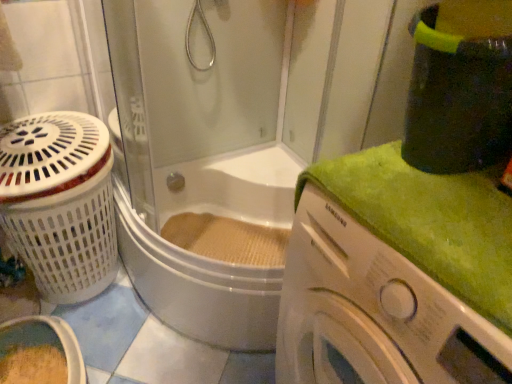
Question: Is white plastic laundry basket at left positioned behind transparent glass shower door at upper center?

Choices:
 (A) no
 (B) yes

Answer: (B)

Question: From the image's perspective, does white plastic laundry basket at left appear lower than transparent glass shower door at upper center?

Choices:
 (A) yes
 (B) no

Answer: (A)

Question: Is white plastic laundry basket at left smaller than transparent glass shower door at upper center?

Choices:
 (A) yes
 (B) no

Answer: (A)

Question: Is white plastic laundry basket at left at the right side of transparent glass shower door at upper center?

Choices:
 (A) no
 (B) yes

Answer: (A)

Question: From the image's perspective, is white plastic laundry basket at left on transparent glass shower door at upper center?

Choices:
 (A) no
 (B) yes

Answer: (A)

Question: Is white plastic laundry basket at left oriented away from transparent glass shower door at upper center?

Choices:
 (A) yes
 (B) no

Answer: (B)

Question: Considering the relative sizes of white plastic laundry basket at left and white glossy washing machine at right in the image provided, is white plastic laundry basket at left taller than white glossy washing machine at right?

Choices:
 (A) yes
 (B) no

Answer: (A)

Question: Is white plastic laundry basket at left at the left side of white glossy washing machine at right?

Choices:
 (A) no
 (B) yes

Answer: (B)

Question: Is white plastic laundry basket at left oriented towards white glossy washing machine at right?

Choices:
 (A) no
 (B) yes

Answer: (A)

Question: Is white plastic laundry basket at left to the right of white glossy washing machine at right from the viewer's perspective?

Choices:
 (A) yes
 (B) no

Answer: (B)

Question: Is white plastic laundry basket at left wider than white glossy washing machine at right?

Choices:
 (A) no
 (B) yes

Answer: (A)

Question: Is white plastic laundry basket at left positioned far away from white glossy washing machine at right?

Choices:
 (A) yes
 (B) no

Answer: (B)

Question: Can you confirm if white glossy washing machine at right is shorter than white plastic laundry basket at left?

Choices:
 (A) yes
 (B) no

Answer: (A)